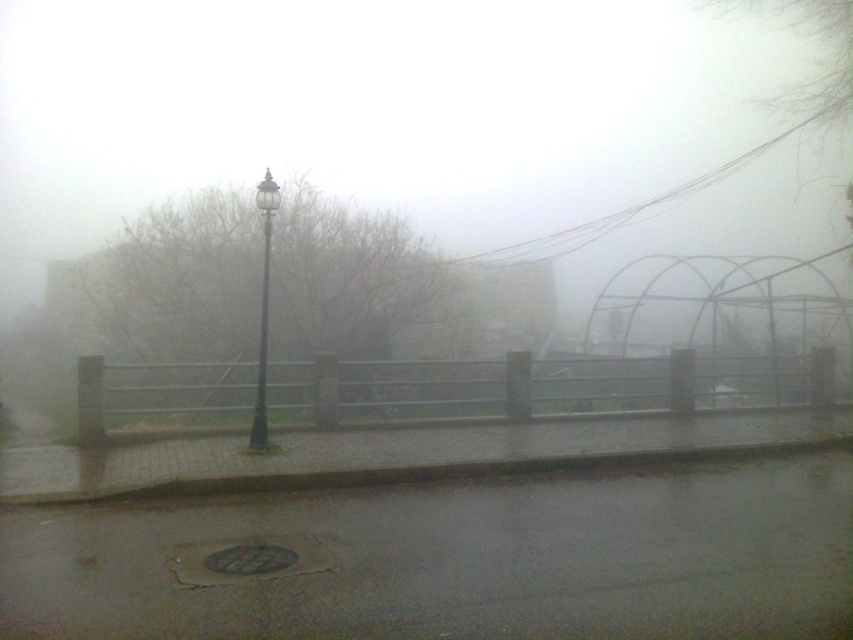
Question: Is wet asphalt at lower center closer to camera compared to black polished street light at center?

Choices:
 (A) yes
 (B) no

Answer: (A)

Question: Can you confirm if wet asphalt at lower center is bigger than black polished street light at center?

Choices:
 (A) no
 (B) yes

Answer: (A)

Question: Which point appears farthest from the camera in this image?

Choices:
 (A) (264, 413)
 (B) (265, 236)
 (C) (811, 481)

Answer: (A)

Question: Is black polished street light at center to the left of black polished pole at center from the viewer's perspective?

Choices:
 (A) no
 (B) yes

Answer: (B)

Question: Estimate the real-world distances between objects in this image. Which object is farther from the wet asphalt at lower center?

Choices:
 (A) black polished pole at center
 (B) black polished street light at center

Answer: (B)

Question: Which object is positioned farthest from the black polished street light at center?

Choices:
 (A) wet asphalt at lower center
 (B) black polished pole at center

Answer: (A)